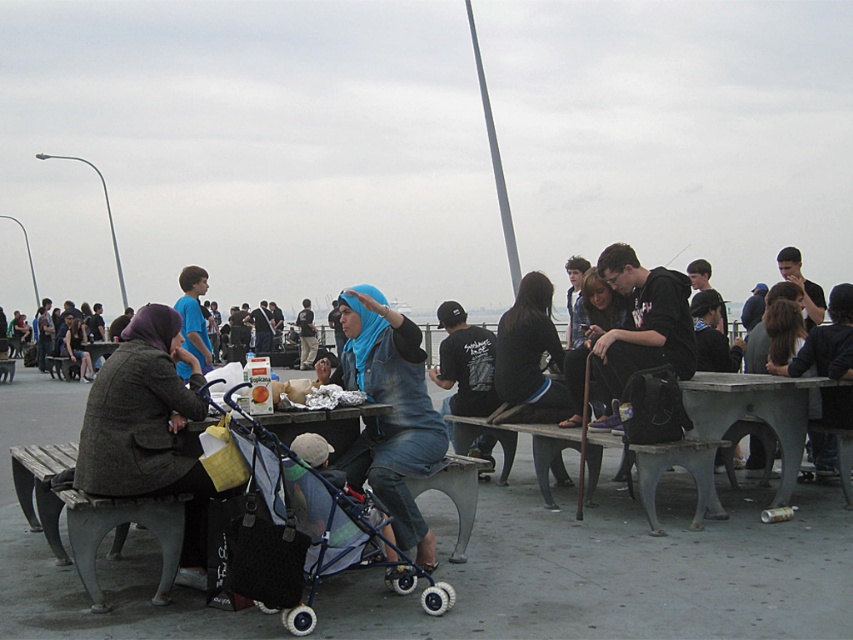
Question: Is the position of blue denim jacket at center less distant than that of gray concrete table at center?

Choices:
 (A) no
 (B) yes

Answer: (B)

Question: Among these objects, which one is farthest from the camera?

Choices:
 (A) gray concrete table at center
 (B) dark blue t-shirt at center
 (C) blue t-shirt at center

Answer: (B)

Question: Is black fabric stroller at center positioned behind denim jacket at center?

Choices:
 (A) yes
 (B) no

Answer: (B)

Question: Considering the real-world distances, which object is closest to the blue denim jacket at center?

Choices:
 (A) denim jacket at center
 (B) dark brown woolen coat at left

Answer: (B)

Question: Can you confirm if blue denim jacket at center is positioned above blue t-shirt at center?

Choices:
 (A) no
 (B) yes

Answer: (A)

Question: Which point is closer to the camera taking this photo?

Choices:
 (A) (474, 332)
 (B) (695, 372)
 (C) (297, 317)

Answer: (B)